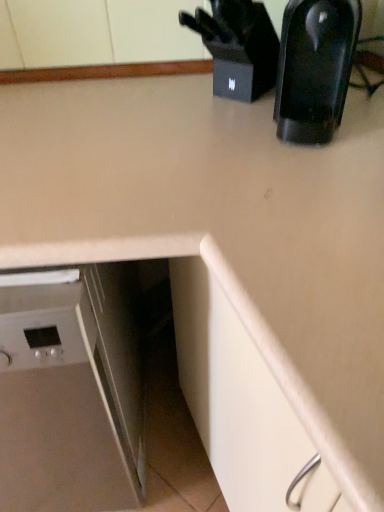
Question: Considering the positions of point (266, 12) and point (349, 65), is point (266, 12) closer or farther from the camera than point (349, 65)?

Choices:
 (A) closer
 (B) farther

Answer: (B)

Question: In terms of height, does black plastic knife block at upper right look taller or shorter compared to black glossy coffee maker at upper right?

Choices:
 (A) tall
 (B) short

Answer: (B)

Question: Which is nearer to the white glossy dishwasher at lower left?

Choices:
 (A) black glossy coffee maker at upper right
 (B) black plastic knife block at upper right

Answer: (A)

Question: Estimate the real-world distances between objects in this image. Which object is farther from the black glossy coffee maker at upper right?

Choices:
 (A) black plastic knife block at upper right
 (B) white glossy dishwasher at lower left

Answer: (B)